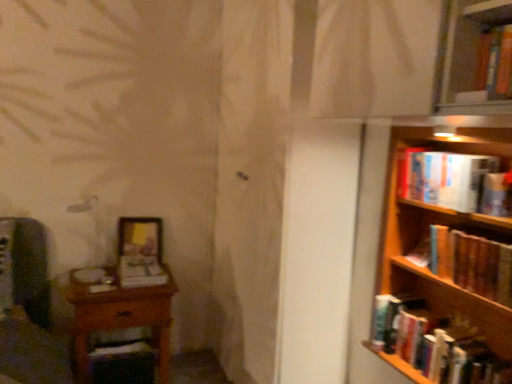
Question: Is hardcover book at right, which is the second book in top-to-bottom order, wider or thinner than wooden bookshelf at right?

Choices:
 (A) thin
 (B) wide

Answer: (A)

Question: From the image's perspective, is hardcover book at right, the 3th book when ordered from bottom to top, positioned above or below wooden bookshelf at right?

Choices:
 (A) above
 (B) below

Answer: (A)

Question: Which of these objects is positioned closest to the matte white book at center, which appears as the second book when ordered from the bottom?

Choices:
 (A) wooden bookshelf at right
 (B) wooden table at left
 (C) hardcover book at right, placed as the 1th book when sorted from right to left
 (D) wooden frame at lower left
 (E) hardcover book at right, the 1th book from the bottom

Answer: (D)

Question: Which of these objects is positioned farthest from the hardcover book at right, which ranks as the fourth book in left-to-right order?

Choices:
 (A) wooden table at left
 (B) matte white book at center, which is the 4th book from right to left
 (C) hardcover book at upper right, placed as the 2th book when sorted from left to right
 (D) hardcover book at right, placed as the 2th book when sorted from right to left
 (E) wooden frame at lower left

Answer: (E)